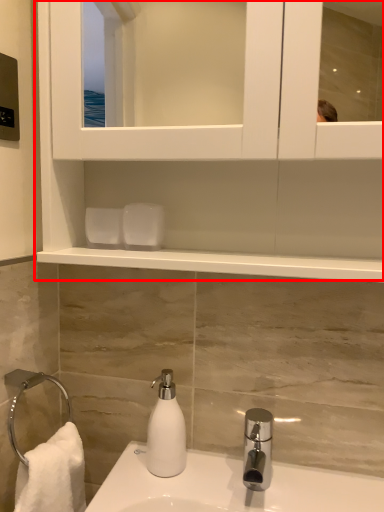
Question: From the image, what is the correct spatial relationship of cabinet (annotated by the red box) in relation to soap dispenser?

Choices:
 (A) left
 (B) right

Answer: (B)